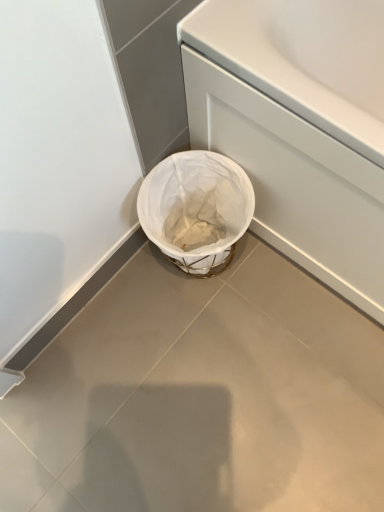
Locate an element on the screen. Image resolution: width=384 pixels, height=512 pixels. empty space that is ontop of white fabric basket at lower center is located at coordinates (198, 396).